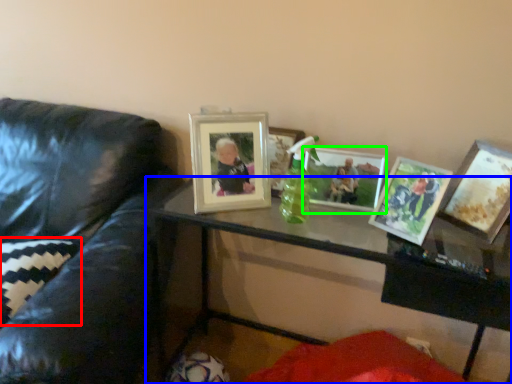
Question: Which is farther away from pillow (highlighted by a red box)? table (highlighted by a blue box) or picture frame (highlighted by a green box)?

Choices:
 (A) table
 (B) picture frame

Answer: (B)